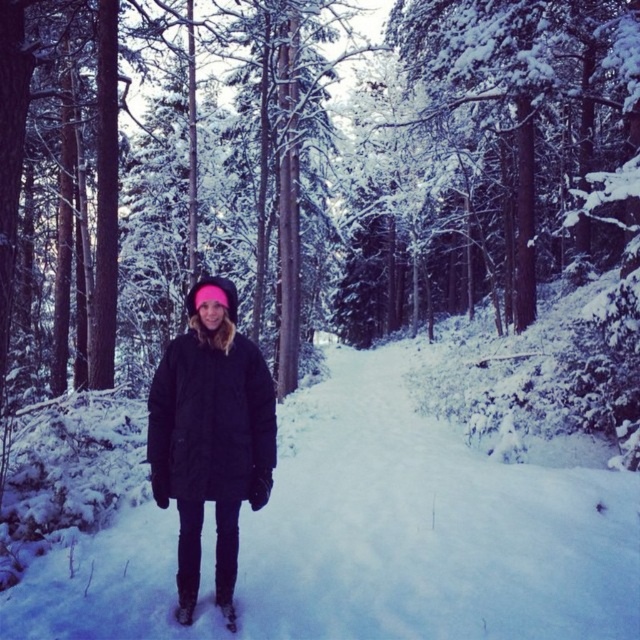
Question: Is white fluffy snow at center bigger than black puffy coat at center?

Choices:
 (A) no
 (B) yes

Answer: (B)

Question: Which object is closer to the camera taking this photo?

Choices:
 (A) black puffy coat at center
 (B) white fluffy snow at center

Answer: (A)

Question: Can you confirm if white fluffy snow at center is bigger than black puffy coat at center?

Choices:
 (A) yes
 (B) no

Answer: (A)

Question: Can you confirm if white fluffy snow at center is positioned above black puffy coat at center?

Choices:
 (A) no
 (B) yes

Answer: (A)